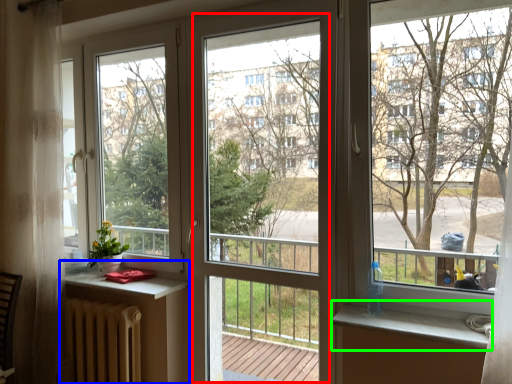
Question: Which is farther away from screen door (highlighted by a red box)? table (highlighted by a blue box) or window sill (highlighted by a green box)?

Choices:
 (A) table
 (B) window sill

Answer: (B)